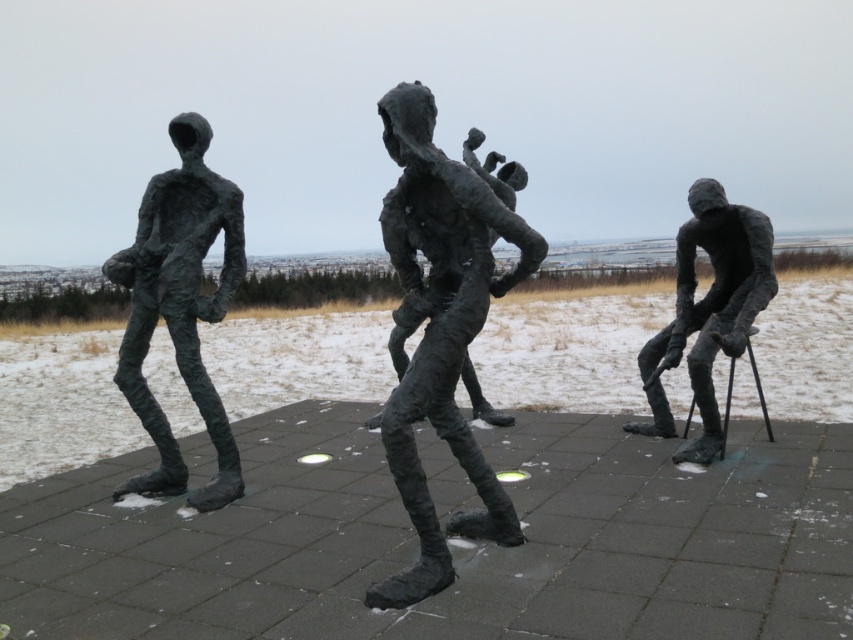
Is bronze sculpture at center closer to camera compared to bronze sculpture at right?

Yes, it is.

Is bronze sculpture at center to the right of bronze sculpture at right from the viewer's perspective?

Incorrect, bronze sculpture at center is not on the right side of bronze sculpture at right.

The height and width of the screenshot is (640, 853). Identify the location of bronze sculpture at center. (442, 323).

Find the location of `bronze sculpture at center`. bronze sculpture at center is located at coordinates (442, 323).

Which is in front, point (181, 289) or point (709, 442)?

Positioned in front is point (181, 289).

Where is `green patina bronze figure at left`? This screenshot has height=640, width=853. green patina bronze figure at left is located at coordinates (180, 307).

I want to click on green patina bronze figure at left, so click(180, 307).

Is bronze sculpture at center to the right of green patina bronze figure at left from the viewer's perspective?

Indeed, bronze sculpture at center is positioned on the right side of green patina bronze figure at left.

Can you confirm if bronze sculpture at center is taller than green patina bronze figure at left?

In fact, bronze sculpture at center may be shorter than green patina bronze figure at left.

Which is behind, point (438, 364) or point (207, 305)?

Point (207, 305)

At what (x,y) coordinates should I click in order to perform the action: click on bronze sculpture at center. Please return your answer as a coordinate pair (x, y). This screenshot has height=640, width=853. Looking at the image, I should click on (442, 323).